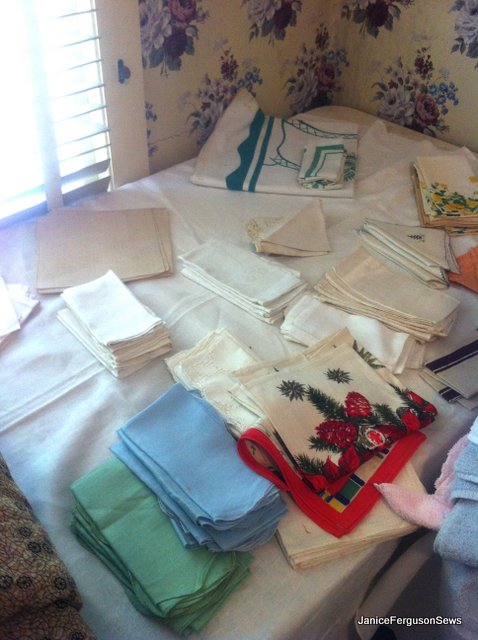
The image size is (478, 640). I want to click on mattress, so click(x=344, y=111).